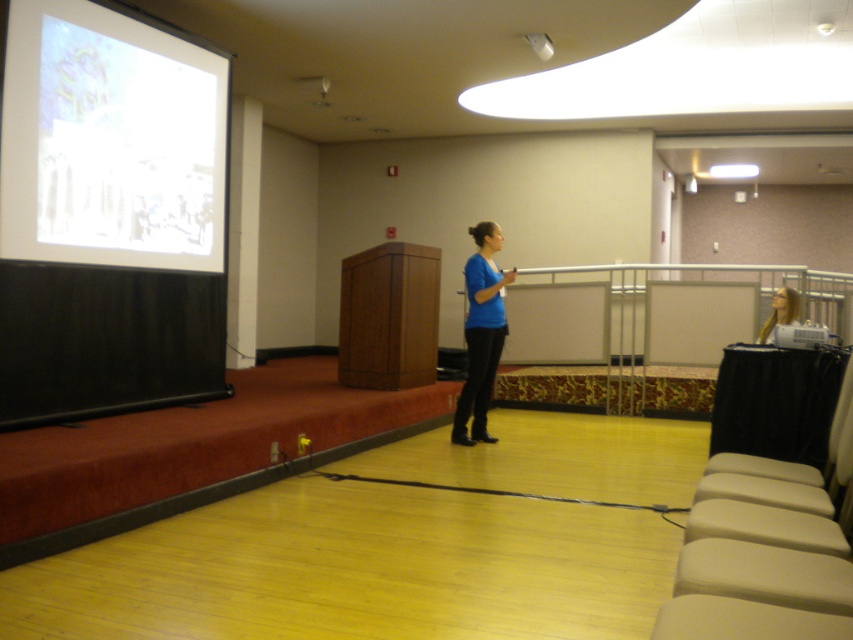
You are an attendee in the conference room and need to locate the white glossy projection screen at upper left and the metallic gray projector at lower right. Which one is positioned higher in the room?

The white glossy projection screen at upper left is positioned higher than the metallic gray projector at lower right because it is located above it.

You are a photographer setting up for a presentation in the conference room. You need to capture a clear photo of the presenter wearing the blue matte shirt at center. What is the minimum distance you should position your camera from the presenter to ensure the photo is in focus?

The blue matte shirt at center is 5.03 meters away from the camera, so you should position your camera at least 5.03 meters away to ensure the photo is in focus.